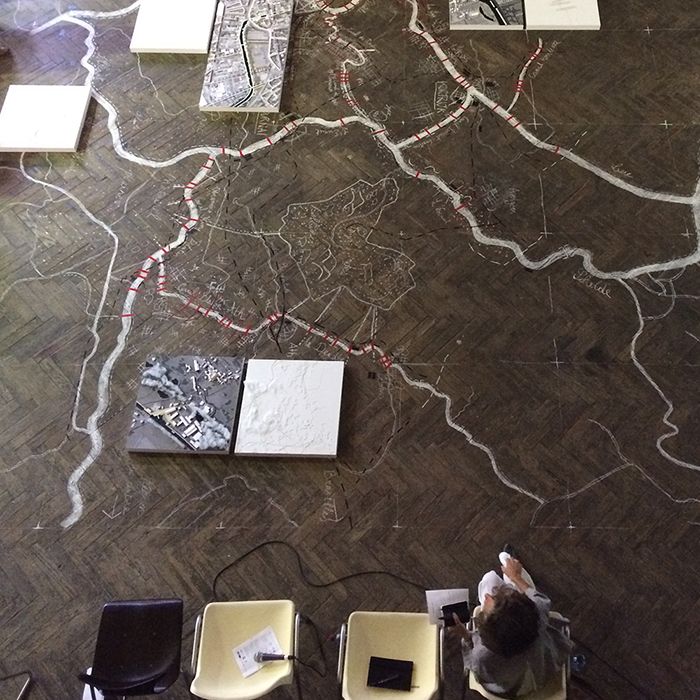
The width and height of the screenshot is (700, 700). In order to click on empty chair in this screenshot , I will do `click(138, 631)`.